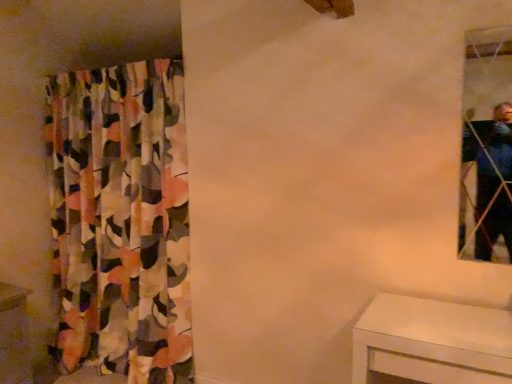
Question: Which is correct: white glossy vanity at lower left is inside clear glass mirror at upper right, or outside of it?

Choices:
 (A) inside
 (B) outside

Answer: (B)

Question: From a real-world perspective, is white glossy vanity at lower left positioned above or below clear glass mirror at upper right?

Choices:
 (A) above
 (B) below

Answer: (B)

Question: Which of these objects is positioned closest to the multicolored fabric curtain at left?

Choices:
 (A) clear glass mirror at upper right
 (B) white glossy vanity at lower left

Answer: (B)

Question: Considering the real-world distances, which object is farthest from the white glossy vanity at lower left?

Choices:
 (A) multicolored fabric curtain at left
 (B) clear glass mirror at upper right

Answer: (B)